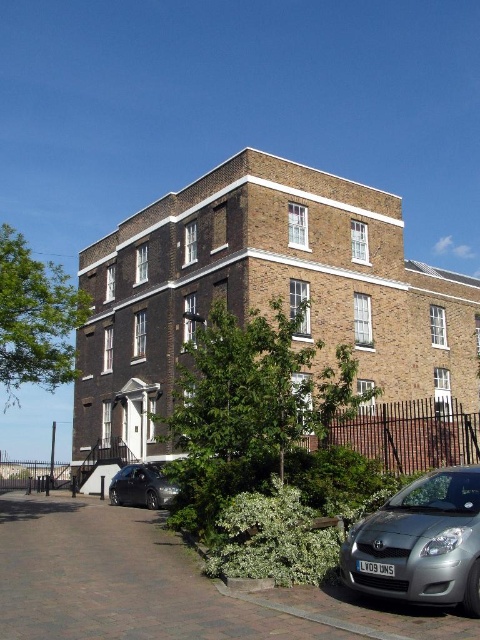
Can you confirm if satin silver car at lower right is shorter than shiny black sedan at lower left?

Correct, satin silver car at lower right is not as tall as shiny black sedan at lower left.

Does satin silver car at lower right appear on the right side of shiny black sedan at lower left?

Yes, satin silver car at lower right is to the right of shiny black sedan at lower left.

Between point (471, 554) and point (119, 484), which one is positioned behind?

Positioned behind is point (119, 484).

Identify the location of satin silver car at lower right. The image size is (480, 640). (420, 541).